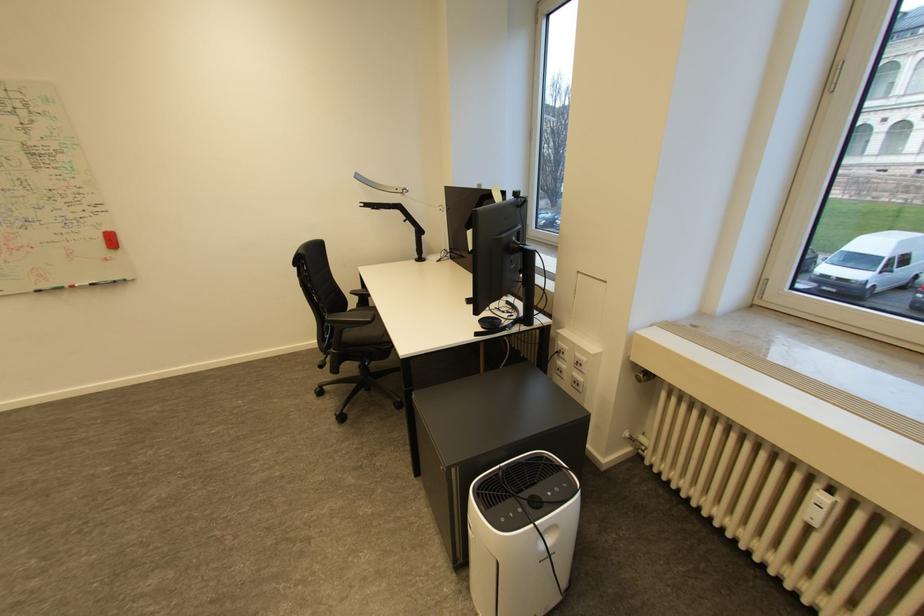
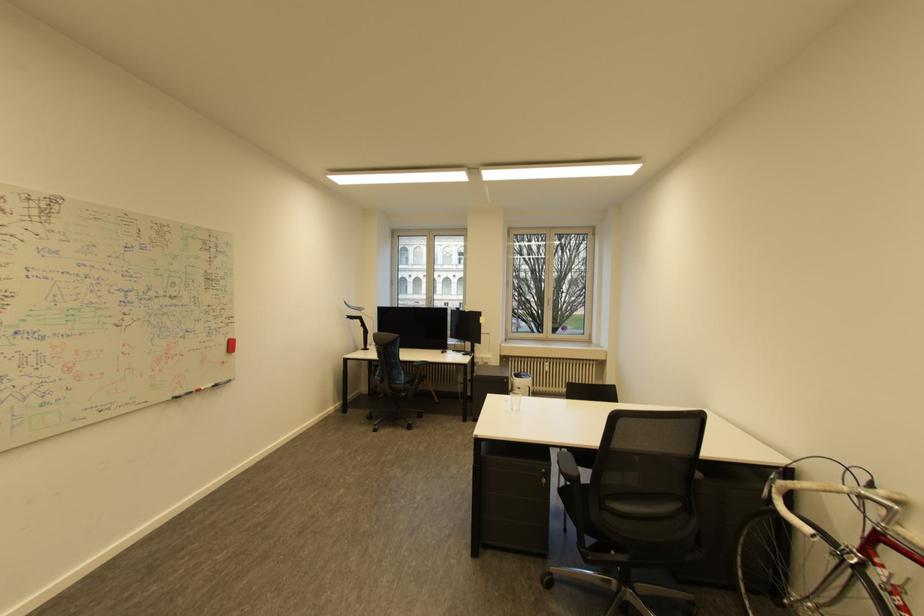
Where in the second image is the point corresponding to the point at 108,235 from the first image?

(234, 342)